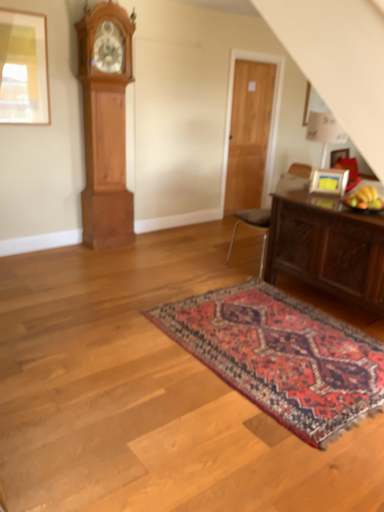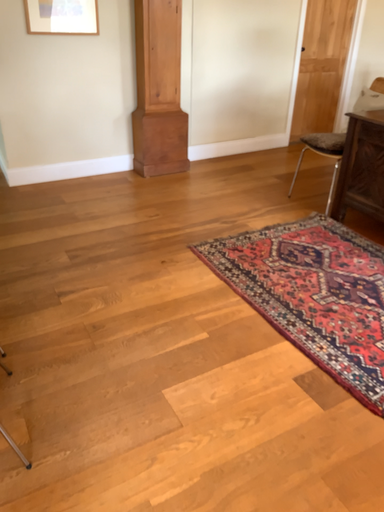
Question: How did the camera likely rotate when shooting the video?

Choices:
 (A) rotated left
 (B) rotated right

Answer: (A)